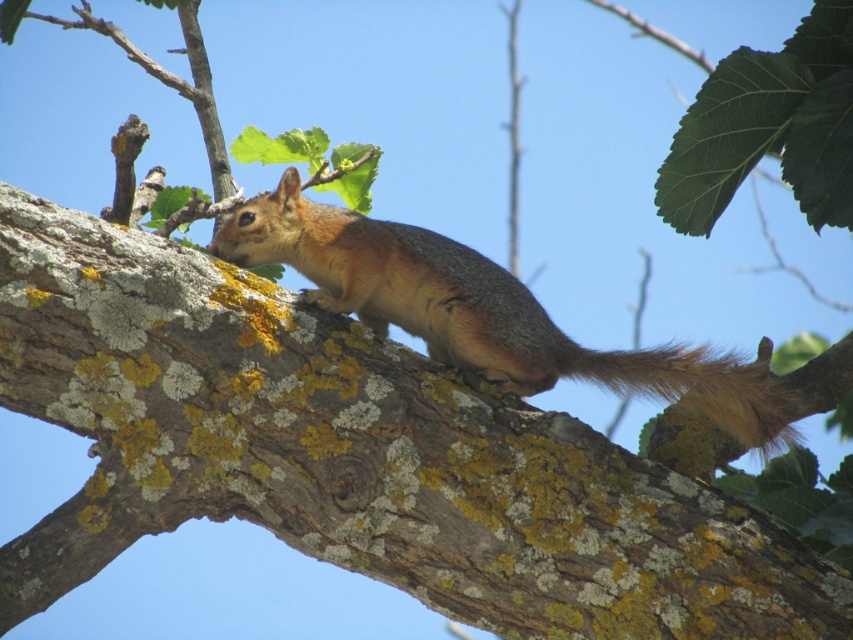
Question: Which object is closer to the camera taking this photo?

Choices:
 (A) golden fur squirrel at center
 (B) brown furry tail at right

Answer: (A)

Question: Is golden fur squirrel at center thinner than brown furry tail at right?

Choices:
 (A) yes
 (B) no

Answer: (B)

Question: Does golden fur squirrel at center have a lesser width compared to brown furry tail at right?

Choices:
 (A) no
 (B) yes

Answer: (A)

Question: Does golden fur squirrel at center have a greater width compared to brown furry tail at right?

Choices:
 (A) no
 (B) yes

Answer: (B)

Question: Which of the following is the closest to the observer?

Choices:
 (A) golden fur squirrel at center
 (B) brown furry tail at right

Answer: (A)